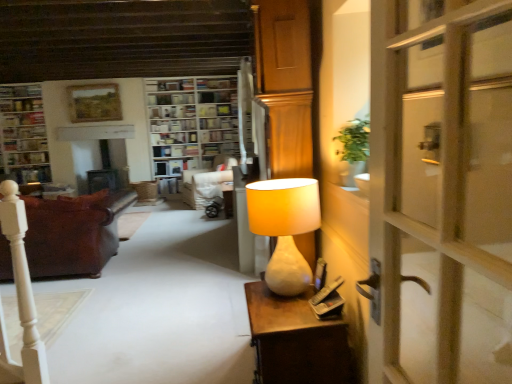
Question: Does leather couch at left have a greater width compared to matte white lamp at right?

Choices:
 (A) no
 (B) yes

Answer: (B)

Question: Can you confirm if leather couch at left is thinner than matte white lamp at right?

Choices:
 (A) yes
 (B) no

Answer: (B)

Question: Can you confirm if leather couch at left is positioned to the right of matte white lamp at right?

Choices:
 (A) yes
 (B) no

Answer: (B)

Question: Can you confirm if leather couch at left is taller than matte white lamp at right?

Choices:
 (A) no
 (B) yes

Answer: (B)

Question: Would you say matte white lamp at right is part of leather couch at left's contents?

Choices:
 (A) yes
 (B) no

Answer: (B)

Question: From the image's perspective, is leather couch at left located beneath matte white lamp at right?

Choices:
 (A) no
 (B) yes

Answer: (B)

Question: Does white wooden bookshelf at upper center, the 2th shelf ordered from the bottom, have a smaller size compared to wooden bookshelf at center?

Choices:
 (A) no
 (B) yes

Answer: (B)

Question: Can you confirm if white wooden bookshelf at upper center, the 2th shelf ordered from the bottom, is bigger than wooden bookshelf at center?

Choices:
 (A) yes
 (B) no

Answer: (B)

Question: Is white wooden bookshelf at upper center, the 2th shelf ordered from the bottom, to the right of wooden bookshelf at center from the viewer's perspective?

Choices:
 (A) yes
 (B) no

Answer: (B)

Question: Is the depth of white wooden bookshelf at upper center, the 1th shelf positioned from the top, greater than that of wooden bookshelf at center?

Choices:
 (A) no
 (B) yes

Answer: (B)

Question: Is white wooden bookshelf at upper center, the 2th shelf ordered from the bottom, facing towards wooden bookshelf at center?

Choices:
 (A) yes
 (B) no

Answer: (A)

Question: From the image's perspective, is white wooden bookshelf at upper center, the 2th shelf ordered from the bottom, located beneath wooden bookshelf at center?

Choices:
 (A) no
 (B) yes

Answer: (A)

Question: From the image's perspective, is matte white lamp at right located beneath white marble desk at right?

Choices:
 (A) yes
 (B) no

Answer: (B)